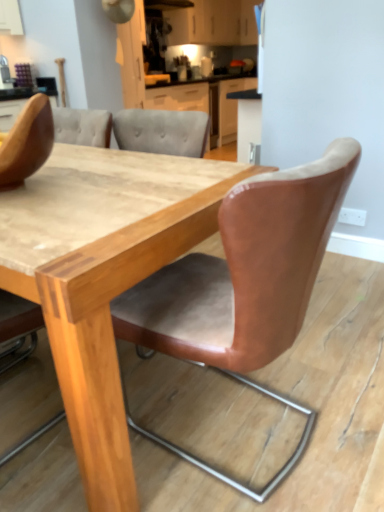
At what (x,y) coordinates should I click in order to perform the action: click on unoccupied region to the right of brown leather chair at upper left, arranged as the second chair when viewed from the right. Please return your answer as a coordinate pair (x, y). This screenshot has width=384, height=512. Looking at the image, I should click on point(108,188).